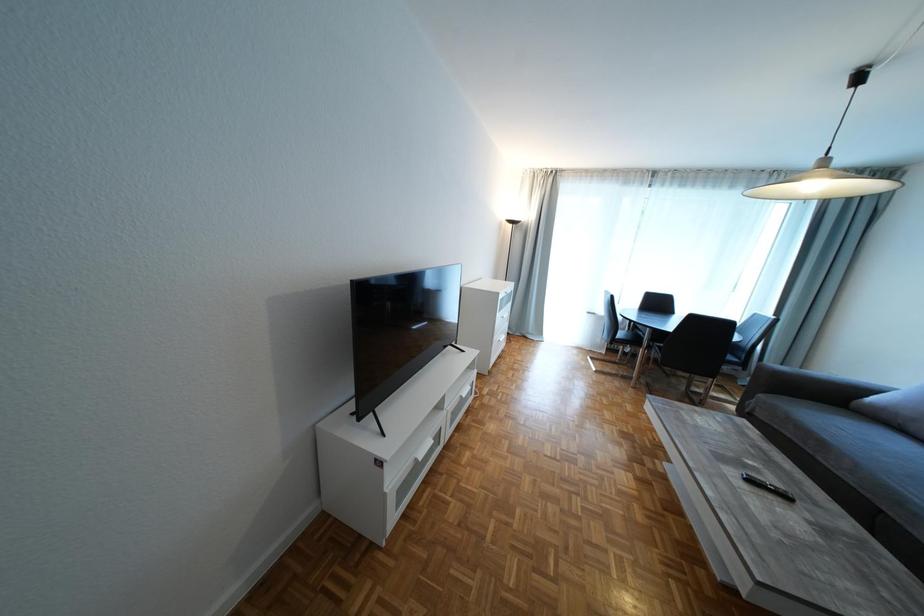
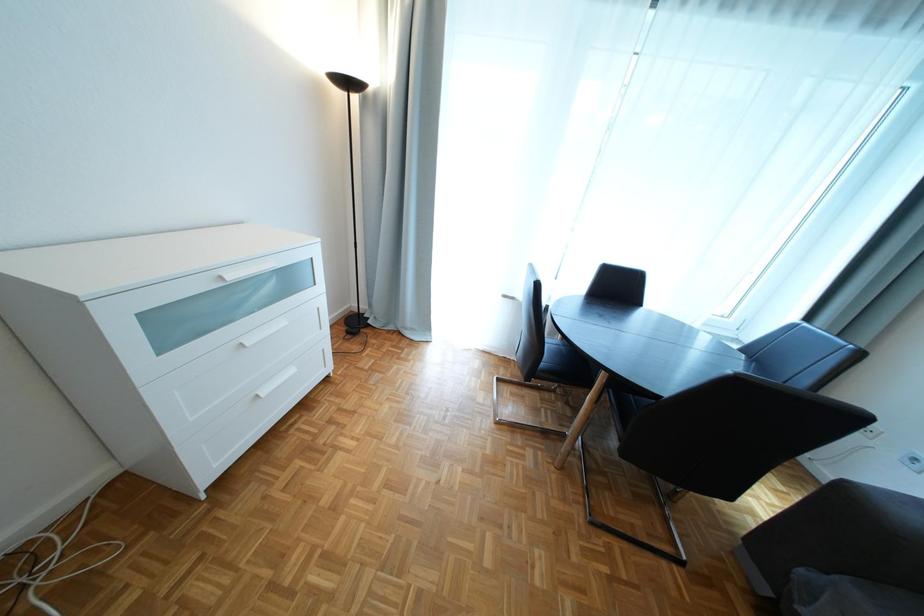
Which direction would the cameraman need to move to produce the second image?

The cameraman moved toward right, forward.